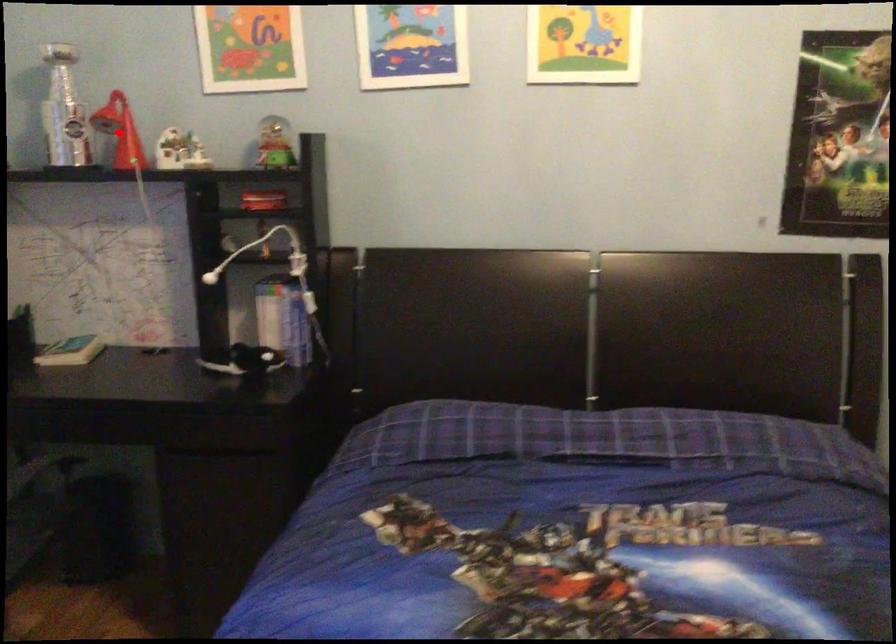
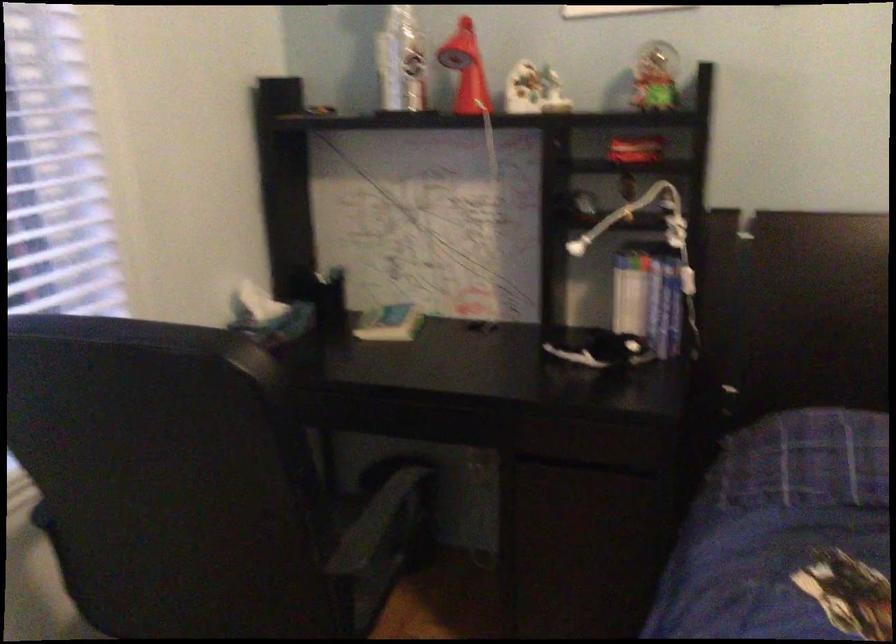
Question: I am providing you with two images of the same scene from different viewpoints. In image1, a red point is highlighted. Considering the same 3D point in image2, which of the following is correct?

Choices:
 (A) It is closer
 (B) It is farther

Answer: (A)